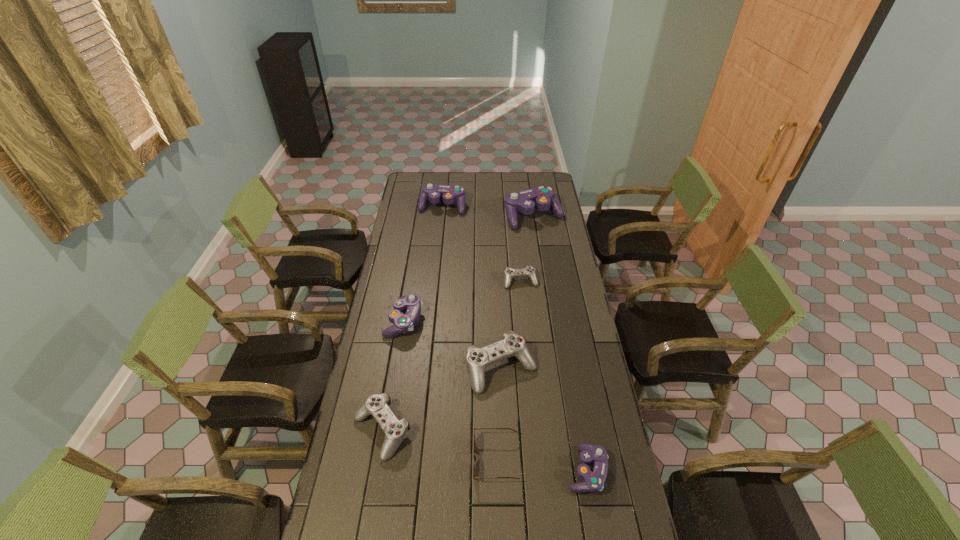
This screenshot has height=540, width=960. What are the coordinates of `the biggest purple control` in the screenshot? It's located at (543, 198).

Find the location of `the tallest object`. the tallest object is located at coordinates (543, 198).

Image resolution: width=960 pixels, height=540 pixels. Find the location of `the seventh shortest object`. the seventh shortest object is located at coordinates (448, 194).

What are the coordinates of `the sixth shortest control` in the screenshot? It's located at (448, 194).

Where is `the third biggest purple control`? This screenshot has height=540, width=960. the third biggest purple control is located at coordinates (402, 323).

Where is `the fourth farthest object`? This screenshot has height=540, width=960. the fourth farthest object is located at coordinates (402, 323).

Image resolution: width=960 pixels, height=540 pixels. I want to click on the third nearest control, so (x=478, y=359).

The image size is (960, 540). I want to click on the biggest white control, so click(x=478, y=359).

Locate an element on the screen. the second biggest white control is located at coordinates (395, 430).

You are a GUI agent. You are given a task and a screenshot of the screen. Output one action in this format:
    pyautogui.click(x=<x>, y=<y>)
    Task: Click on the leftmost white control
    
    Given the screenshot: What is the action you would take?
    pyautogui.click(x=395, y=430)